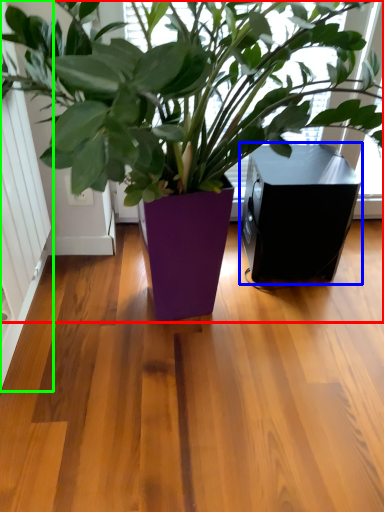
Question: Considering the real-world distances, which object is farthest from houseplant (highlighted by a red box)? speaker (highlighted by a blue box) or screen door (highlighted by a green box)?

Choices:
 (A) speaker
 (B) screen door

Answer: (B)